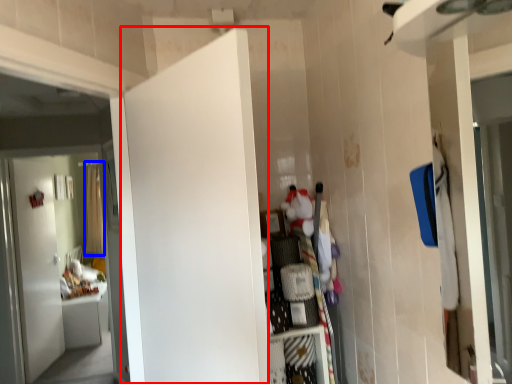
Question: Which point is closer to the camera, door (highlighted by a red box) or curtain (highlighted by a blue box)?

Choices:
 (A) door
 (B) curtain

Answer: (A)